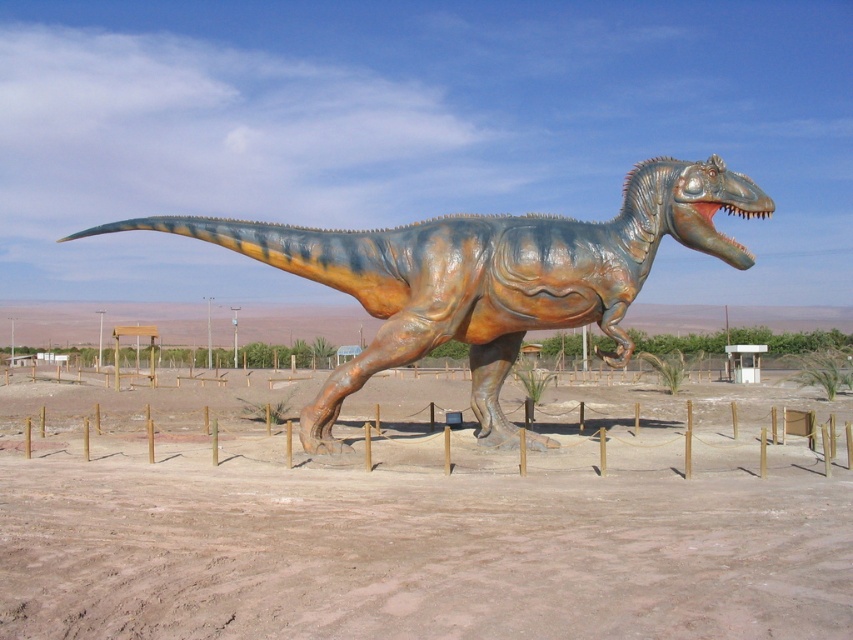
Question: Which point is closer to the camera?

Choices:
 (A) shiny bronze dinosaur at center
 (B) brown sandy dirt at center

Answer: (B)

Question: Does brown sandy dirt at center have a larger size compared to shiny bronze dinosaur at center?

Choices:
 (A) yes
 (B) no

Answer: (B)

Question: Where is brown sandy dirt at center located in relation to shiny bronze dinosaur at center in the image?

Choices:
 (A) above
 (B) below

Answer: (B)

Question: Is the position of brown sandy dirt at center less distant than that of shiny bronze dinosaur at center?

Choices:
 (A) no
 (B) yes

Answer: (B)

Question: Which point appears farthest from the camera in this image?

Choices:
 (A) (627, 227)
 (B) (737, 476)

Answer: (A)